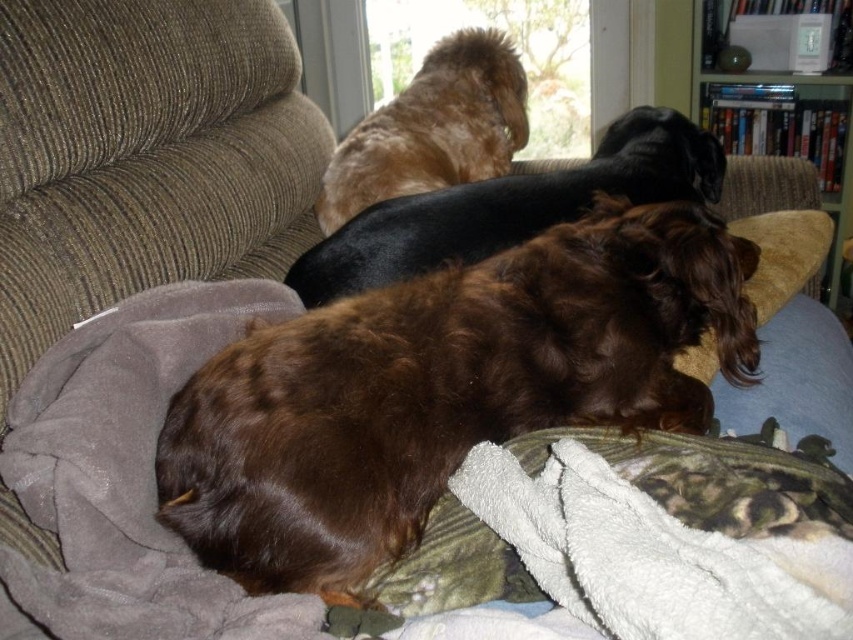
You are standing in front of the couch and want to place a small toy between the two points on the couch indicated by the coordinates point (444,481) and point (547,209). Which point is closer to you where you should place the toy first?

Point (444,481) is closer to the viewer than point (547,209), so you should place the toy at point (444,481) first.

You are a photographer trying to capture a photo of the brown fuzzy dog at center and the shiny brown fur at upper center. Since you want both subjects to be in focus, you need to know which one is closer to the camera. Which dog is positioned closer to the camera?

The brown fuzzy dog at center is positioned below the shiny brown fur at upper center, meaning it is closer to the camera.

You are standing in front of the couch and want to place a small toy exactly where the shiny brown fur at upper center is located. What are the coordinates where you should place the toy?

The coordinates for the shiny brown fur at upper center are at point (x=433, y=129), so you should place the toy at those coordinates.